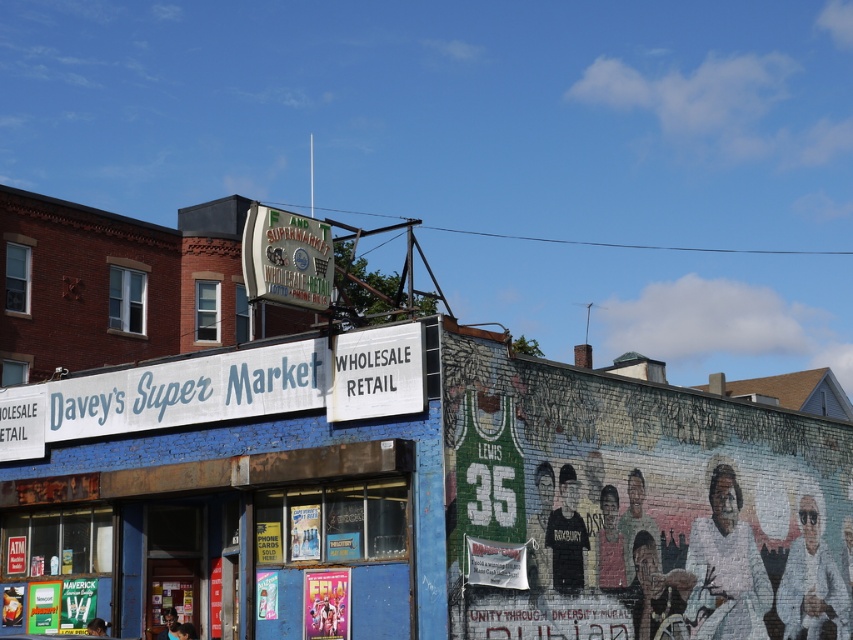
In the scene shown: You are a delivery person trying to locate Davey Super Market. You see a point at coordinates [235,490]. What is located at that point?

The point at [235,490] is where the blue painted brick Davey Super Market is located at center.